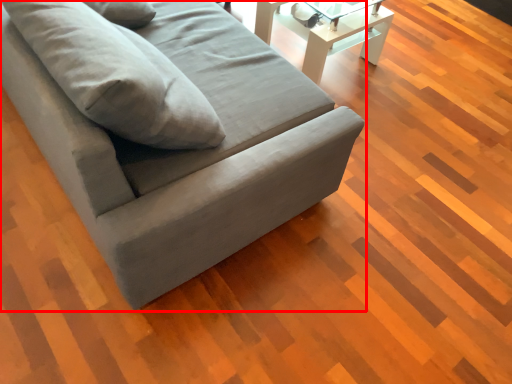
Question: From the image's perspective, what is the correct spatial relationship of studio couch (annotated by the red box) in relation to table?

Choices:
 (A) above
 (B) below

Answer: (B)